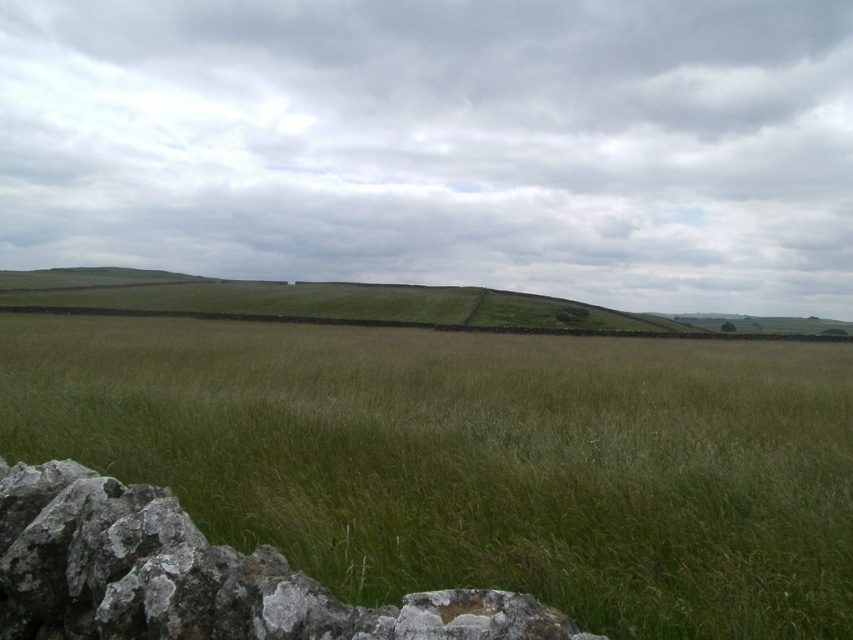
You are standing at the base of the gray rough stone at lower left and want to climb up to the green grassy hillside at center. Is the stone a good foothold for this climb?

The gray rough stone at lower left is positioned under the green grassy hillside at center, so it can serve as a foothold for climbing up.

Please provide the coordinates of the green grassy field at center in the image. The coordinate system uses the bottom left corner as the origin point. The first number is the x coordinate from 0 to 1, and the second number is the y coordinate from 0 to 1. Please answer with the coordinates in the format of two numbers separated by a comma, like 0.5,0.5.

The coordinates of the green grassy field at center are (x=474, y=460).